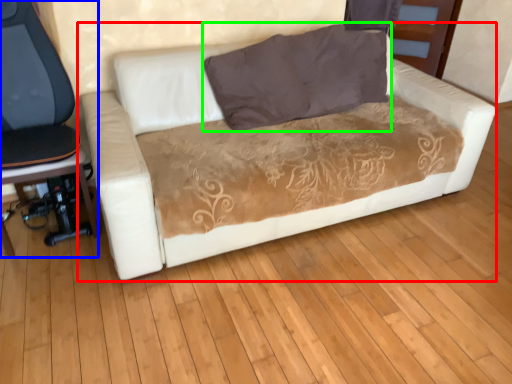
Question: Based on their relative distances, which object is nearer to studio couch (highlighted by a red box)? Choose from chair (highlighted by a blue box) and pillow (highlighted by a green box).

Choices:
 (A) chair
 (B) pillow

Answer: (B)